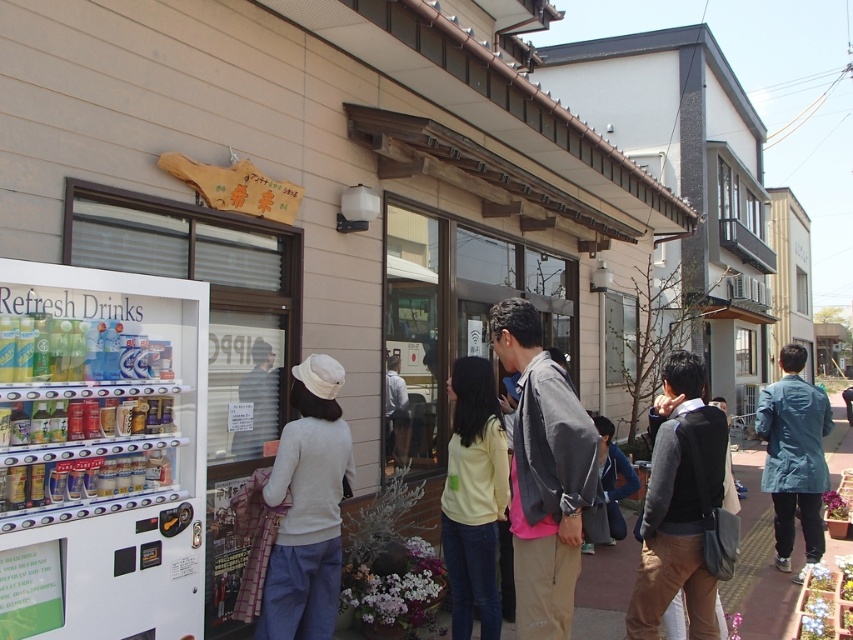
Question: Estimate the real-world distances between objects in this image. Which object is closer to the white plastic vending machine at lower left?

Choices:
 (A) gray fabric jacket at center
 (B) denim jacket at lower right
 (C) teal fabric jacket at right
 (D) yellow matte shirt at center

Answer: (A)

Question: Which point is farther to the camera?

Choices:
 (A) (466, 432)
 (B) (772, 493)

Answer: (B)

Question: Does gray fabric jacket at center lie behind teal fabric jacket at right?

Choices:
 (A) yes
 (B) no

Answer: (B)

Question: Can you confirm if white plastic vending machine at lower left is bigger than gray fabric jacket at center?

Choices:
 (A) yes
 (B) no

Answer: (A)

Question: Among these objects, which one is farthest from the camera?

Choices:
 (A) gray fabric jacket at center
 (B) denim jacket at lower right

Answer: (B)

Question: In this image, where is white plastic vending machine at lower left located relative to gray fabric jacket at center?

Choices:
 (A) left
 (B) right

Answer: (A)